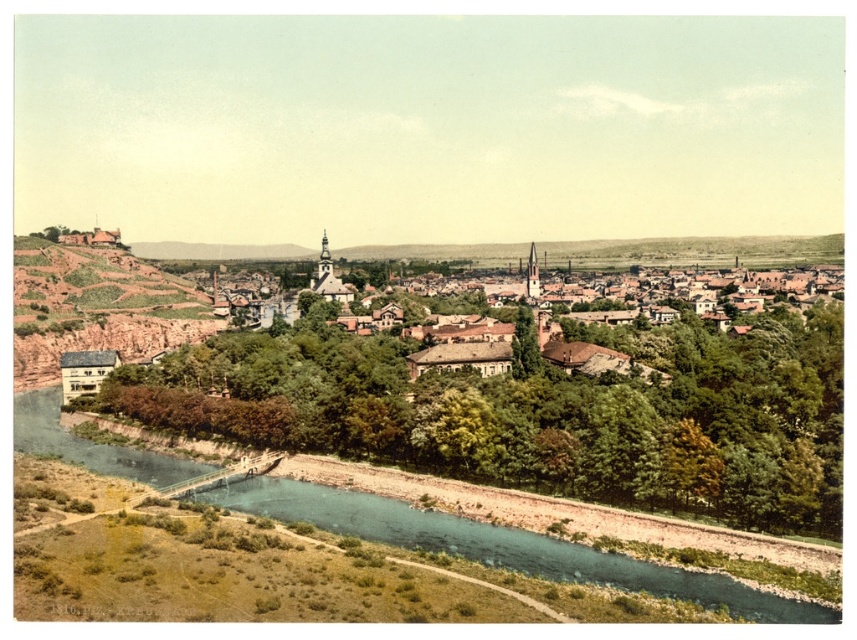
Based on the photo, you are standing on the riverbank in the town scene. There is a point marked at coordinates (502, 547). What is located at that point?

The point at coordinates (502, 547) indicates greenish blue water at lower center.